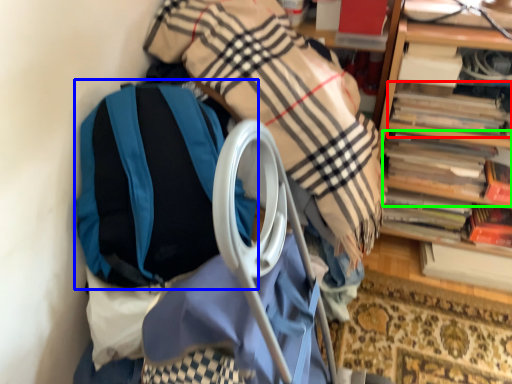
Question: Which object is positioned closest to book (highlighted by a red box)? Select from backpack (highlighted by a blue box) and book (highlighted by a green box).

Choices:
 (A) backpack
 (B) book

Answer: (B)